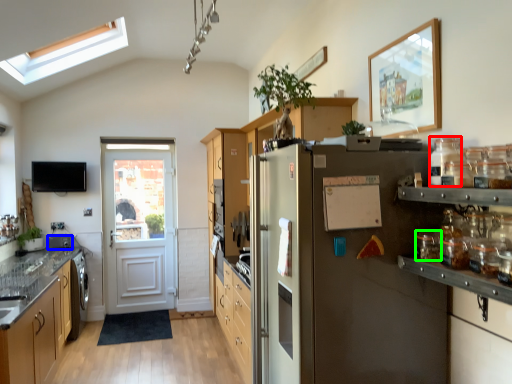
Question: Which object is positioned farthest from glass jar (highlighted by a red box)? Select from appliance (highlighted by a blue box) and glass jar (highlighted by a green box).

Choices:
 (A) appliance
 (B) glass jar

Answer: (A)